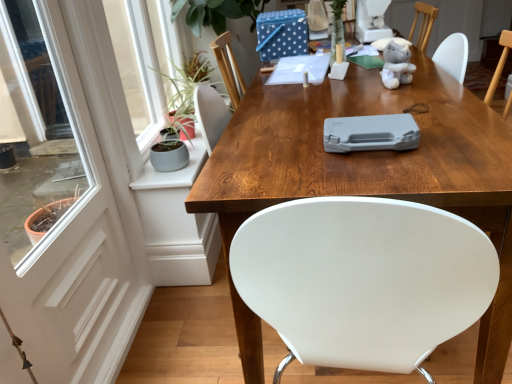
Question: From a real-world perspective, is white glossy screen door at left on top of wooden table at center?

Choices:
 (A) yes
 (B) no

Answer: (A)

Question: Is white glossy screen door at left shorter than wooden table at center?

Choices:
 (A) yes
 (B) no

Answer: (B)

Question: Considering the relative positions of white glossy screen door at left and wooden table at center in the image provided, is white glossy screen door at left behind wooden table at center?

Choices:
 (A) yes
 (B) no

Answer: (B)

Question: Is white glossy screen door at left at the left side of wooden table at center?

Choices:
 (A) no
 (B) yes

Answer: (B)

Question: From the image's perspective, is white glossy screen door at left on wooden table at center?

Choices:
 (A) no
 (B) yes

Answer: (A)

Question: Considering the relative sizes of white glossy screen door at left and wooden table at center in the image provided, is white glossy screen door at left thinner than wooden table at center?

Choices:
 (A) no
 (B) yes

Answer: (B)

Question: Considering the relative positions of soft gray plush bear at upper right and white glossy screen door at left in the image provided, is soft gray plush bear at upper right to the right of white glossy screen door at left from the viewer's perspective?

Choices:
 (A) yes
 (B) no

Answer: (A)

Question: Is soft gray plush bear at upper right to the left of white glossy screen door at left from the viewer's perspective?

Choices:
 (A) no
 (B) yes

Answer: (A)

Question: Is white glossy screen door at left located within soft gray plush bear at upper right?

Choices:
 (A) no
 (B) yes

Answer: (A)

Question: Is soft gray plush bear at upper right aimed at white glossy screen door at left?

Choices:
 (A) no
 (B) yes

Answer: (A)

Question: Does soft gray plush bear at upper right have a greater height compared to white glossy screen door at left?

Choices:
 (A) yes
 (B) no

Answer: (B)

Question: From a real-world perspective, is soft gray plush bear at upper right positioned under white glossy screen door at left based on gravity?

Choices:
 (A) yes
 (B) no

Answer: (B)

Question: Is soft gray plush bear at upper right smaller than wooden table at center?

Choices:
 (A) yes
 (B) no

Answer: (A)